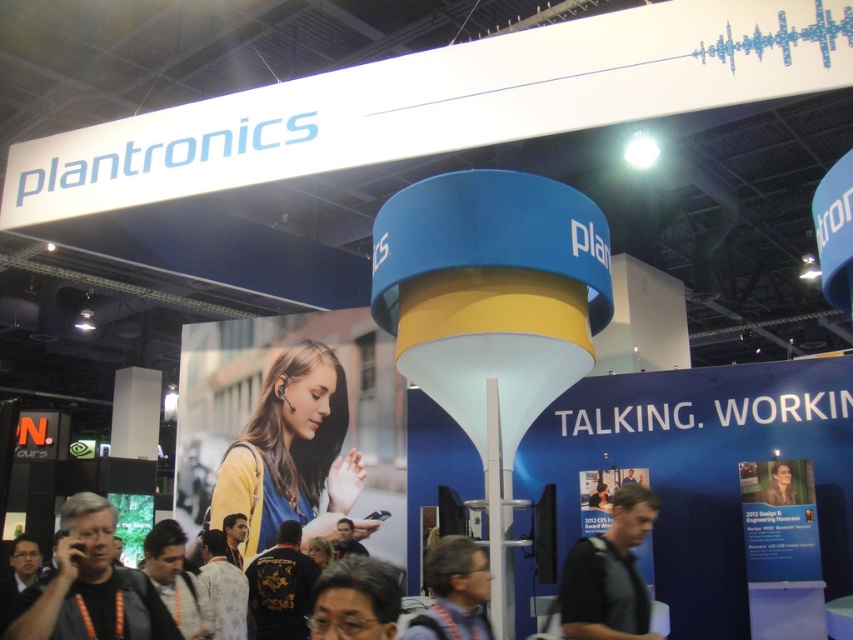
Question: Can you confirm if matte black glasses at lower center is wider than black leather jacket at lower center?

Choices:
 (A) no
 (B) yes

Answer: (A)

Question: Does gray fabric glasses at lower center have a smaller size compared to black leather jacket at lower center?

Choices:
 (A) no
 (B) yes

Answer: (B)

Question: Which object appears closest to the camera in this image?

Choices:
 (A) yellow matte earbud at center
 (B) black leather jacket at lower center

Answer: (B)

Question: Does yellow matte earbud at center appear on the right side of black leather jacket at lower center?

Choices:
 (A) no
 (B) yes

Answer: (A)

Question: Which point is farther to the camera?

Choices:
 (A) matte black phone at lower left
 (B) black leather jacket at lower center

Answer: (B)

Question: Which point is farther to the camera?

Choices:
 (A) matte black woman at center
 (B) matte black glasses at lower center
 (C) black leather jacket at lower center

Answer: (A)